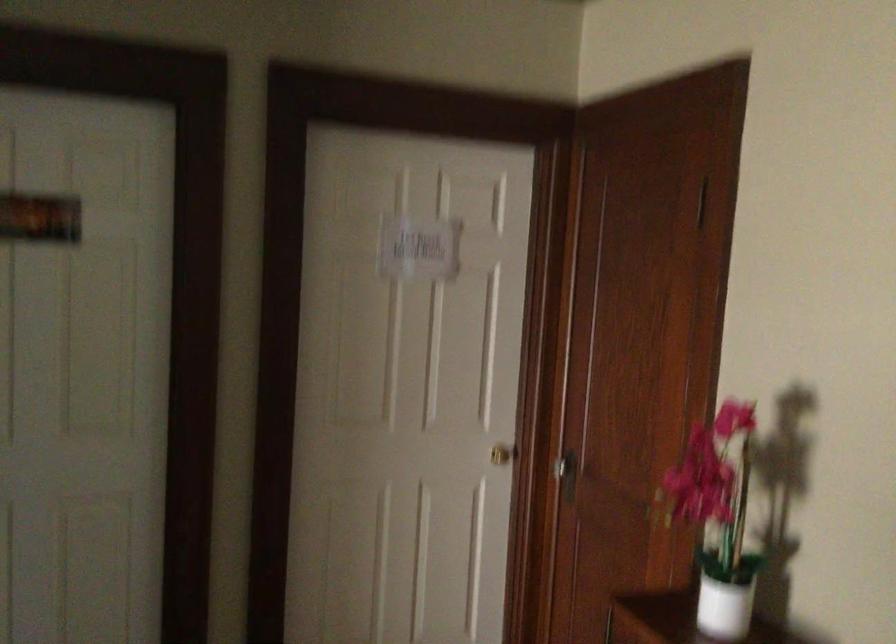
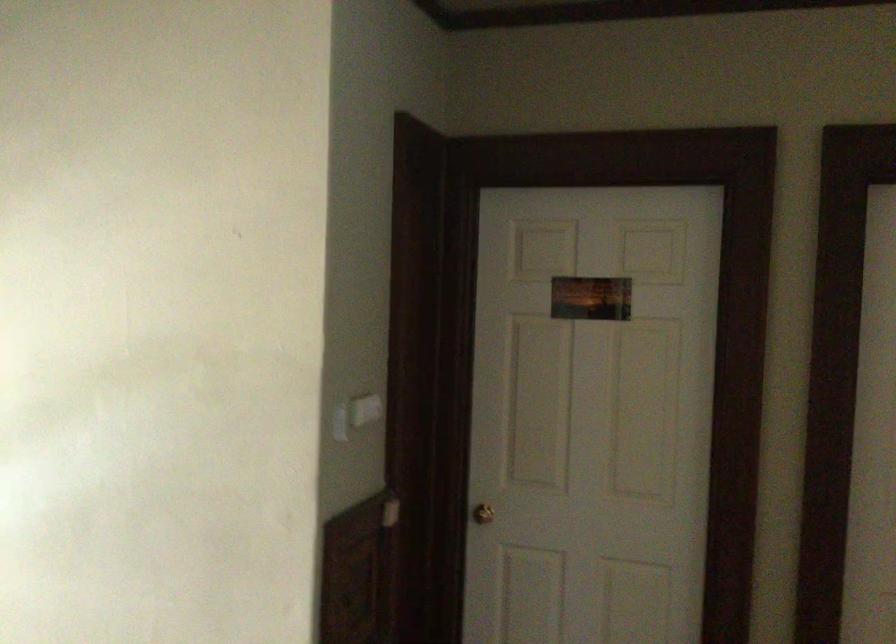
Question: The images are taken continuously from a first-person perspective. In which direction is your viewpoint rotating?

Choices:
 (A) Left
 (B) Right
 (C) Up
 (D) Down

Answer: (A)